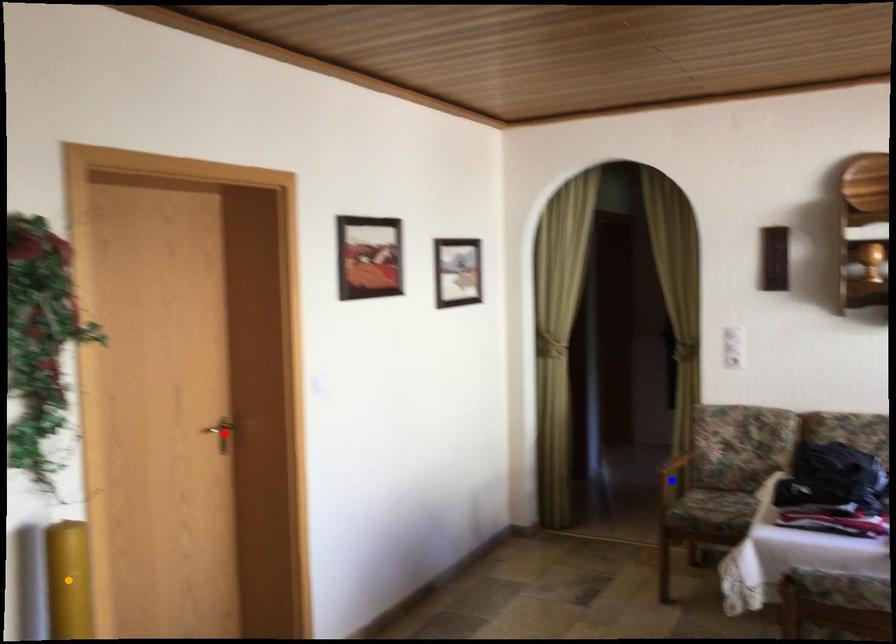
Order these from nearest to farthest:
orange point, blue point, red point

1. orange point
2. red point
3. blue point